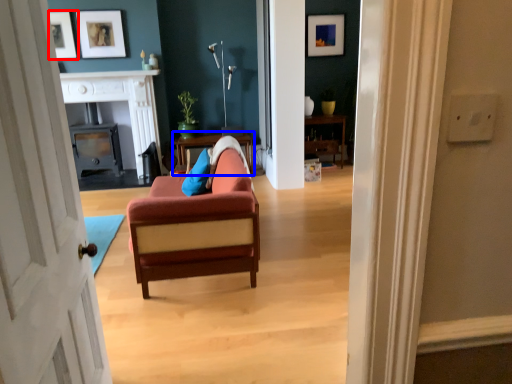
Question: Which of the following is the farthest to the observer, picture frame (highlighted by a red box) or table (highlighted by a blue box)?

Choices:
 (A) picture frame
 (B) table

Answer: (B)